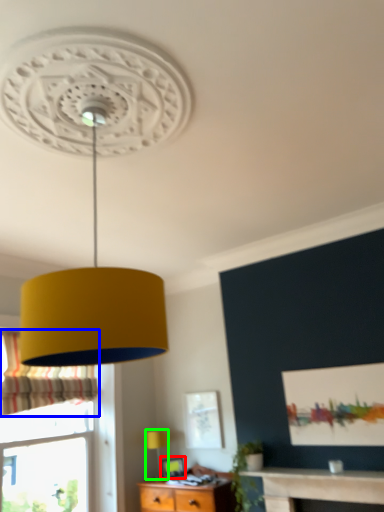
Question: Based on their relative distances, which object is farther from picture frame (highlighted by a red box)? Choose from curtain (highlighted by a blue box) and table lamp (highlighted by a green box).

Choices:
 (A) curtain
 (B) table lamp

Answer: (A)